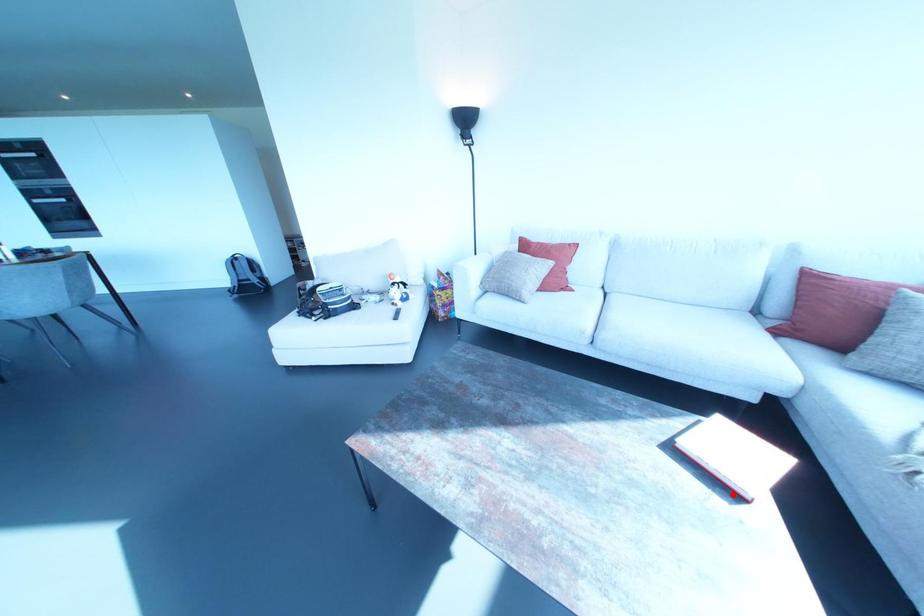
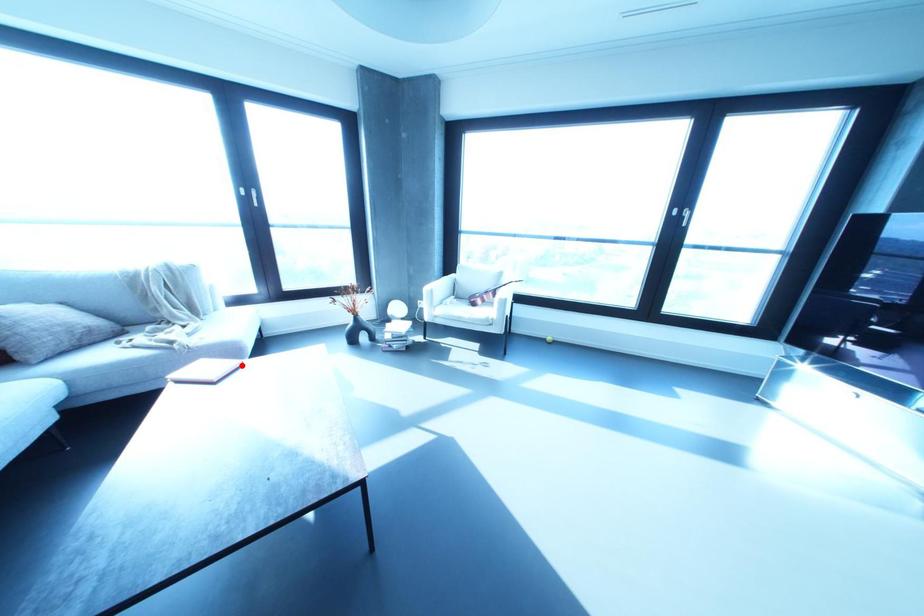
I am providing you with two images of the same scene from different viewpoints. A red point is marked on the first image and another point is marked on the second image. Are the points marked in image1 and image2 representing the same 3D position?

Yes